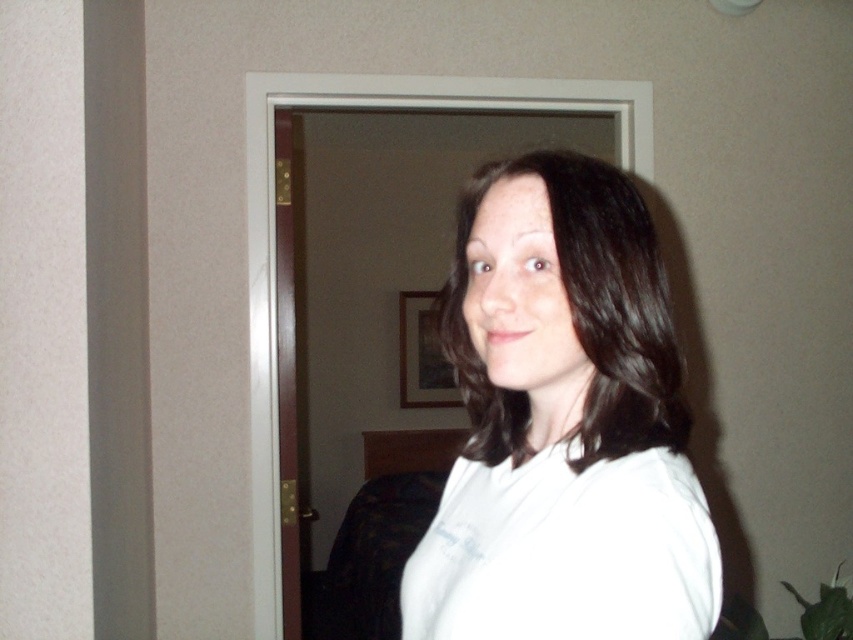
Can you confirm if white matte shirt at center is taller than white cotton shirt at center?

Indeed, white matte shirt at center has a greater height compared to white cotton shirt at center.

Does white matte shirt at center have a lesser height compared to white cotton shirt at center?

No, white matte shirt at center is not shorter than white cotton shirt at center.

I want to click on white matte shirt at center, so click(x=563, y=424).